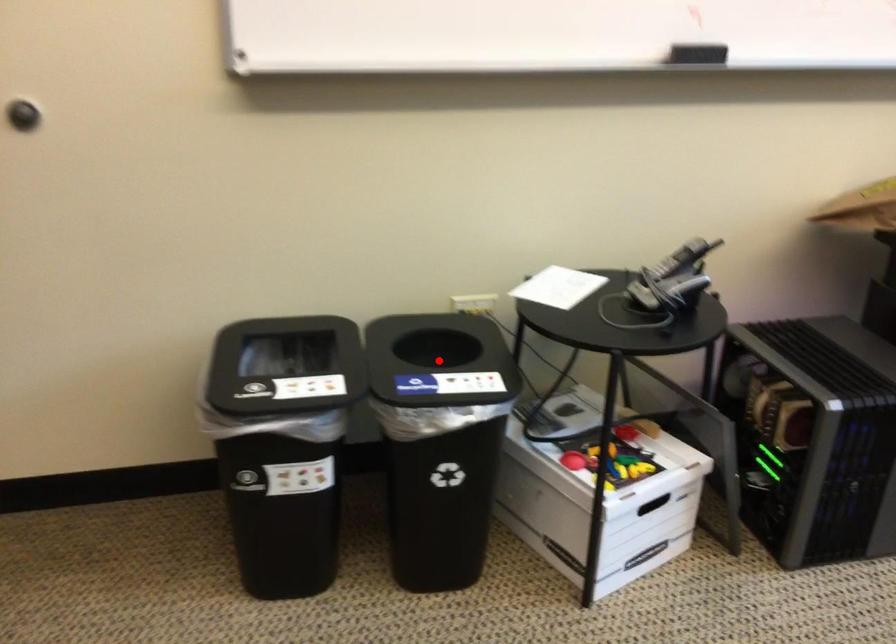
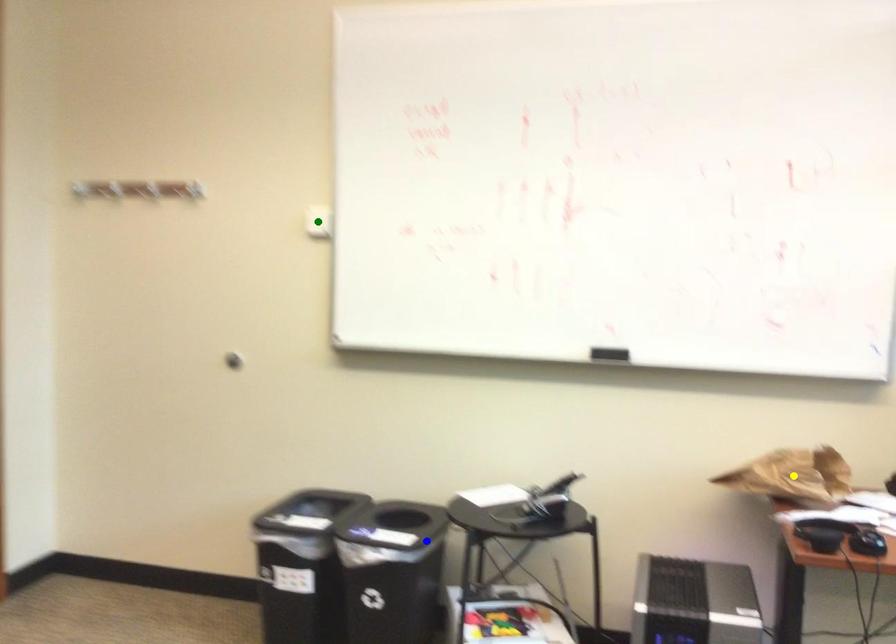
Question: I am providing you with two images of the same scene from different viewpoints. A red point is marked on the first image. You are given multiple points on the second image. Which mark in image 2 goes with the point in image 1?

Choices:
 (A) yellow point
 (B) blue point
 (C) green point

Answer: (B)